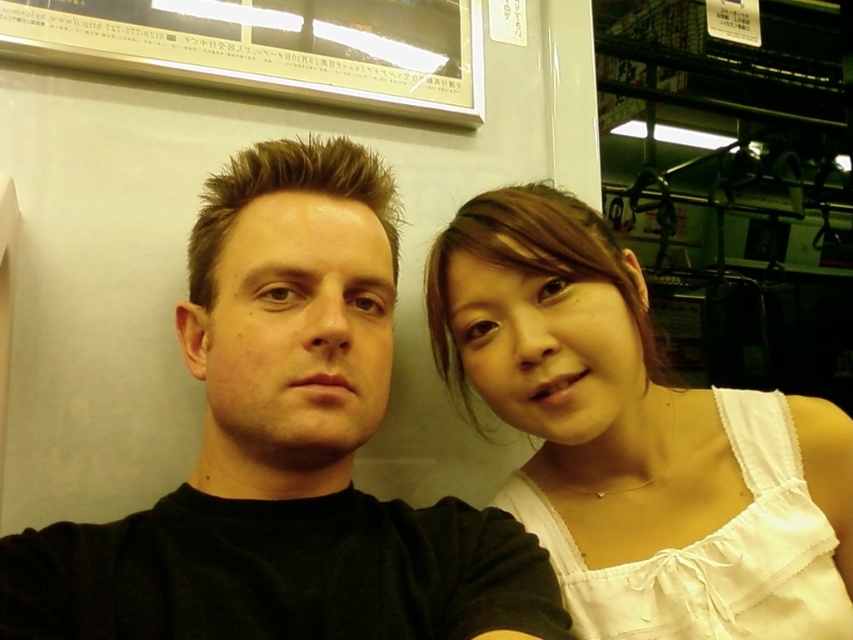
Question: Which point is farther from the camera taking this photo?

Choices:
 (A) (364, 365)
 (B) (824, 524)

Answer: (B)

Question: From the image, what is the correct spatial relationship of black matte shirt at center in relation to white cotton tank top at right?

Choices:
 (A) left
 (B) right

Answer: (A)

Question: Is black matte shirt at center positioned before white cotton tank top at right?

Choices:
 (A) yes
 (B) no

Answer: (A)

Question: Can you confirm if black matte shirt at center is bigger than white cotton tank top at right?

Choices:
 (A) no
 (B) yes

Answer: (A)